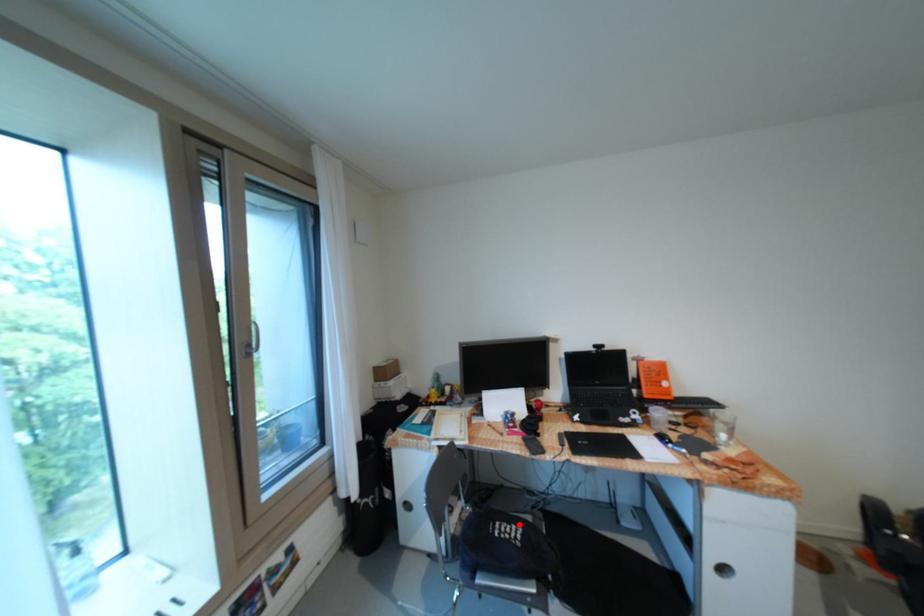
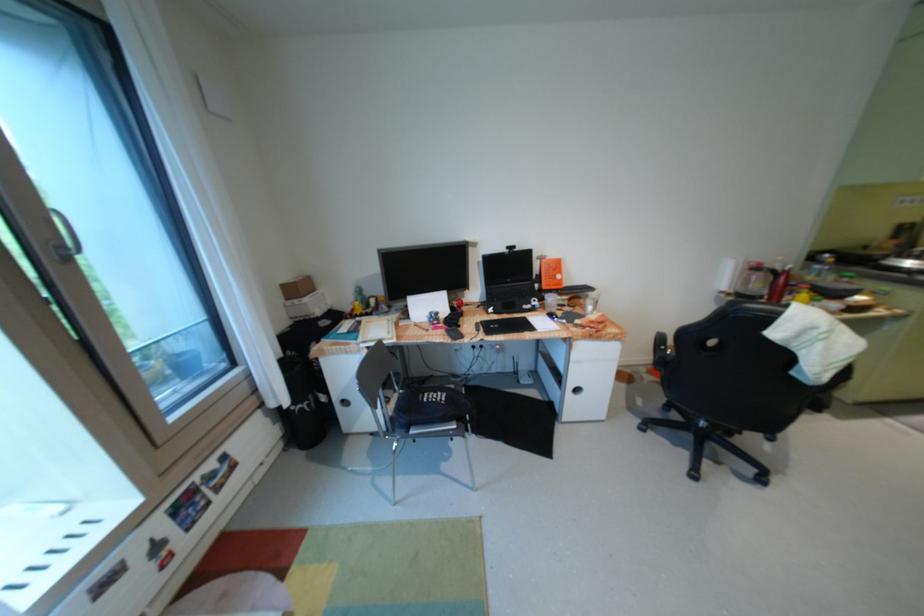
Question: A red point is marked in image1. In image2, is the corresponding 3D point closer to the camera or farther? Reply with the corresponding letter.

Choices:
 (A) The corresponding 3D point is closer.
 (B) The corresponding 3D point is farther.

Answer: (A)